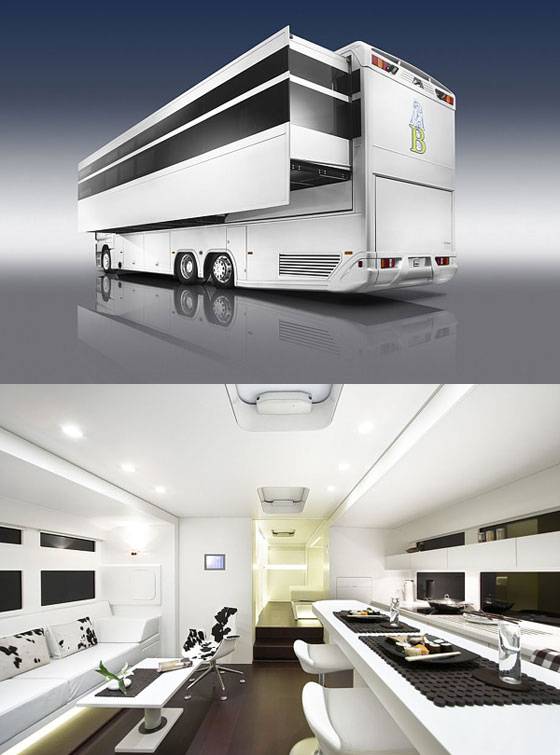
Locate an element on the screen. Image resolution: width=560 pixels, height=755 pixels. place to sit and relax is located at coordinates (214, 639), (97, 649), (26, 701).